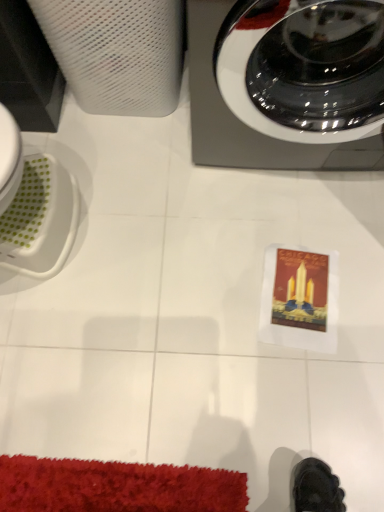
Identify the location of vacant space in between metallic gray washing machine at upper right and white mesh paper towel at upper left. coord(143,148).